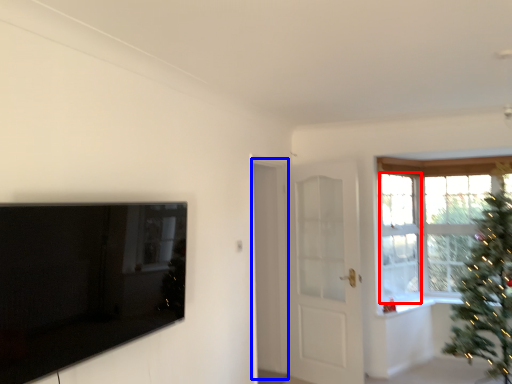
Question: Which of the following is the closest to the observer, window (highlighted by a red box) or screen door (highlighted by a blue box)?

Choices:
 (A) window
 (B) screen door

Answer: (B)